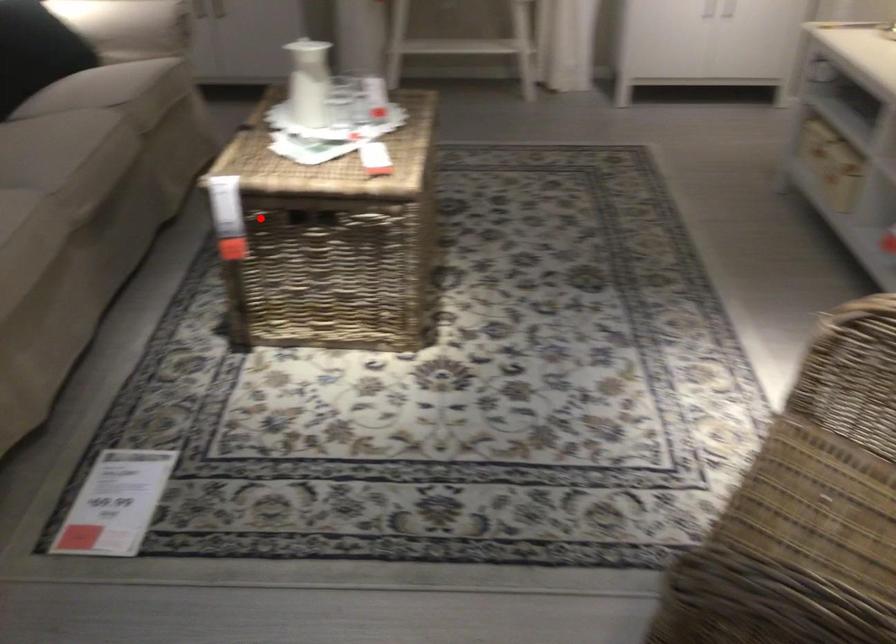
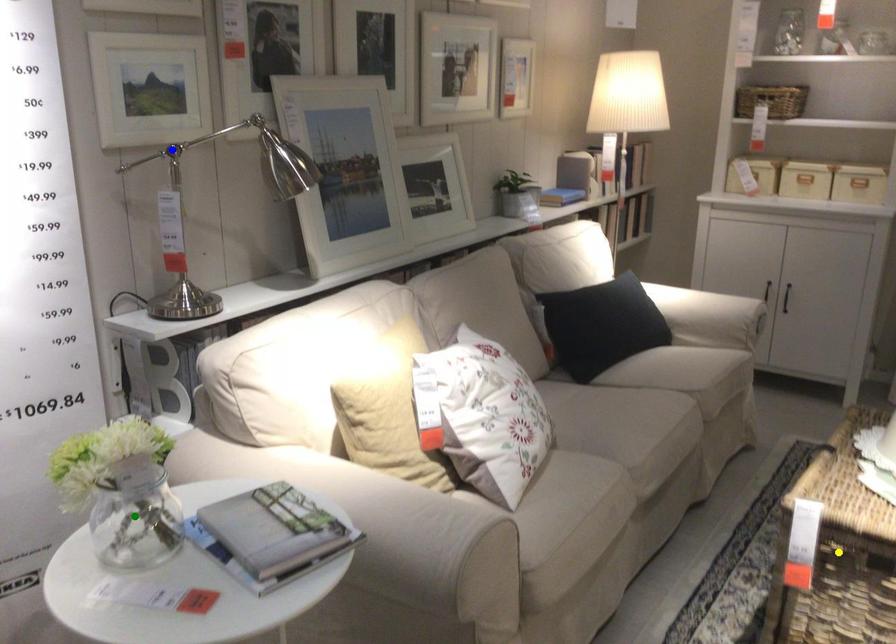
Question: I am providing you with two images of the same scene from different viewpoints. A red point is marked on the first image. You are given multiple points on the second image. Which spot in image 2 lines up with the point in image 1?

Choices:
 (A) blue point
 (B) yellow point
 (C) green point

Answer: (B)